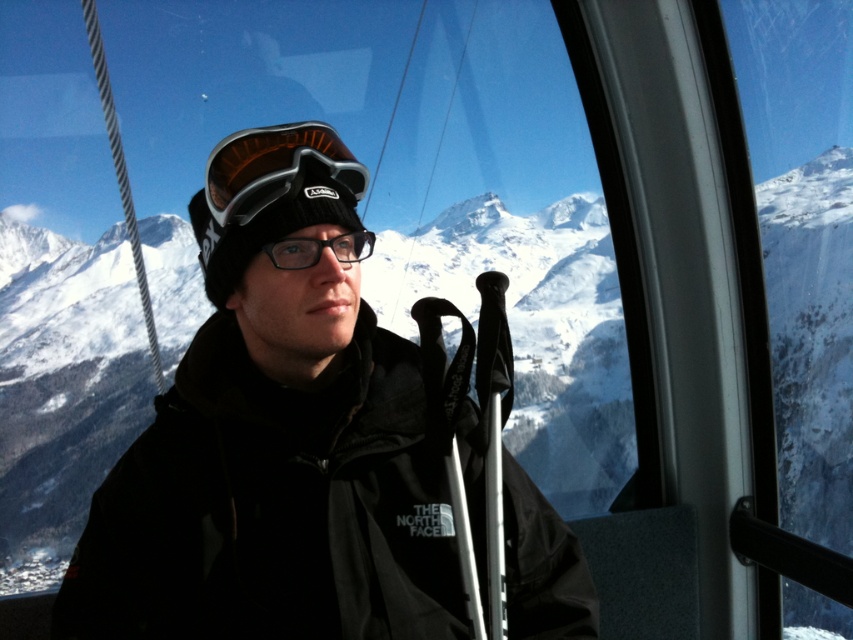
Consider the image. Between black matte jacket at center and matte black goggles at center, which one has less height?

Standing shorter between the two is matte black goggles at center.

Who is more distant from viewer, (135, 609) or (332, 147)?

Point (332, 147)

In order to click on black matte jacket at center in this screenshot , I will do coord(286,435).